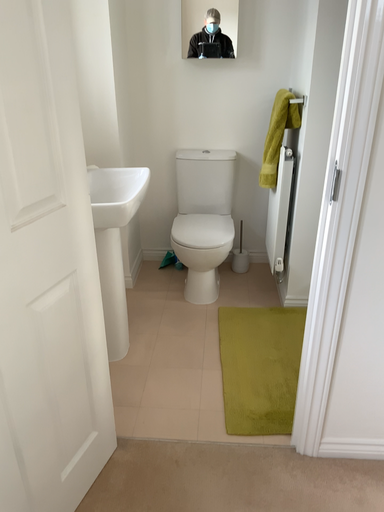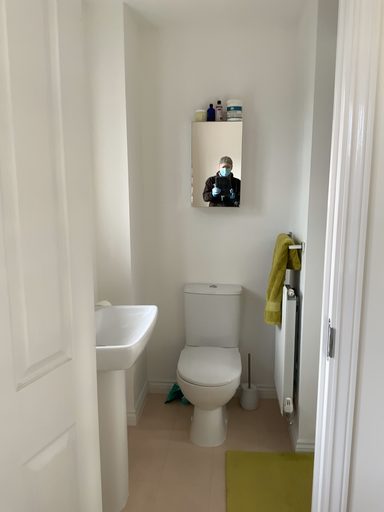
Question: How did the camera likely rotate when shooting the video?

Choices:
 (A) rotated downward
 (B) rotated upward

Answer: (B)